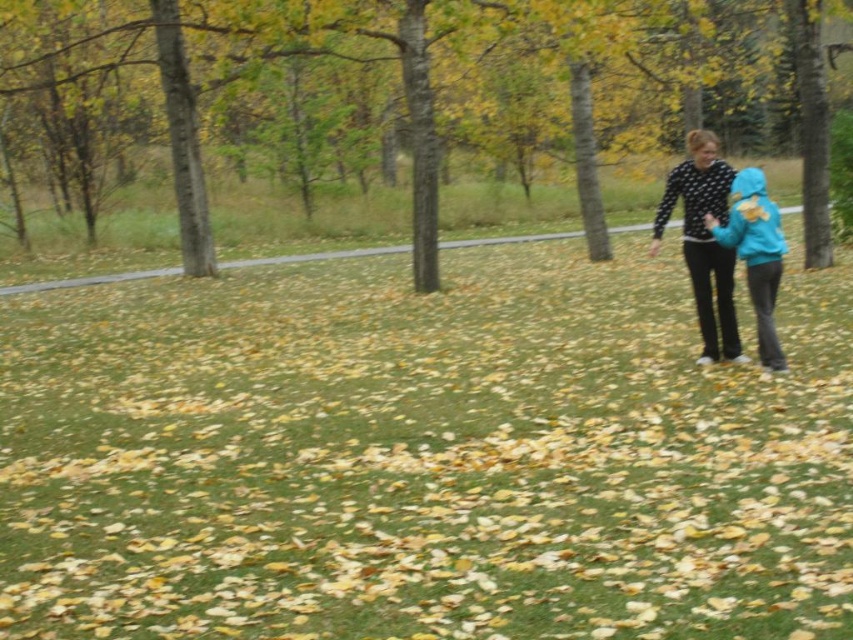
Question: Can you confirm if brown bark tree at center is wider than blue fleece jacket at right?

Choices:
 (A) no
 (B) yes

Answer: (B)

Question: Can you confirm if brown bark tree at center is positioned to the right of black dotted sweater at right?

Choices:
 (A) no
 (B) yes

Answer: (A)

Question: In this image, where is brown bark tree at center located relative to blue fleece jacket at right?

Choices:
 (A) left
 (B) right

Answer: (A)

Question: Which object is closer to the camera taking this photo?

Choices:
 (A) blue fleece jacket at right
 (B) black dotted sweater at right

Answer: (B)

Question: Which of the following is the closest to the observer?

Choices:
 (A) (766, 259)
 (B) (498, 58)
 (C) (693, 170)

Answer: (A)

Question: Which of the following is the farthest from the observer?

Choices:
 (A) black dotted sweater at right
 (B) blue fleece jacket at right

Answer: (B)